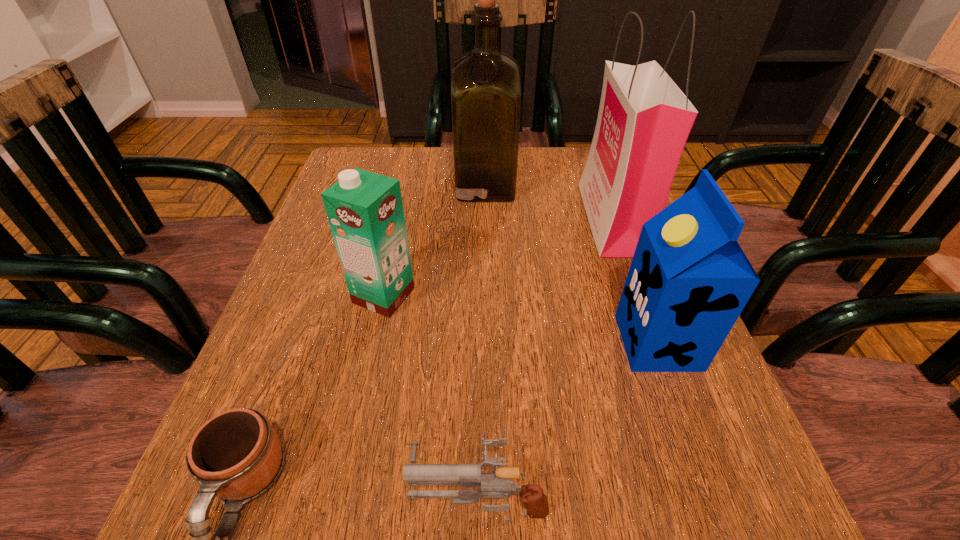
At what (x,y) coordinates should I click in order to perform the action: click on shopping bag. Please return your answer as a coordinate pair (x, y). This screenshot has height=540, width=960. Looking at the image, I should click on (644, 119).

At what (x,y) coordinates should I click in order to perform the action: click on liquor. Please return your answer as a coordinate pair (x, y). The height and width of the screenshot is (540, 960). Looking at the image, I should click on (486, 95).

Locate an element on the screen. the right carton is located at coordinates (689, 280).

Where is `the left carton`? The width and height of the screenshot is (960, 540). the left carton is located at coordinates (365, 211).

Image resolution: width=960 pixels, height=540 pixels. In order to click on the shorter carton in this screenshot , I will do `click(365, 211)`.

Locate an element on the screen. vacant space located on the front-facing side of the shopping bag is located at coordinates (520, 218).

This screenshot has width=960, height=540. What are the coordinates of `vacant space located on the front-facing side of the shopping bag` in the screenshot? It's located at click(422, 218).

Image resolution: width=960 pixels, height=540 pixels. I want to click on vacant space situated 0.200m on the front-facing side of the shopping bag, so click(498, 218).

This screenshot has width=960, height=540. What are the coordinates of `free region located 0.160m on the label of the liquor` in the screenshot? It's located at (392, 185).

What are the coordinates of `free space located on the label of the liquor` in the screenshot? It's located at (339, 185).